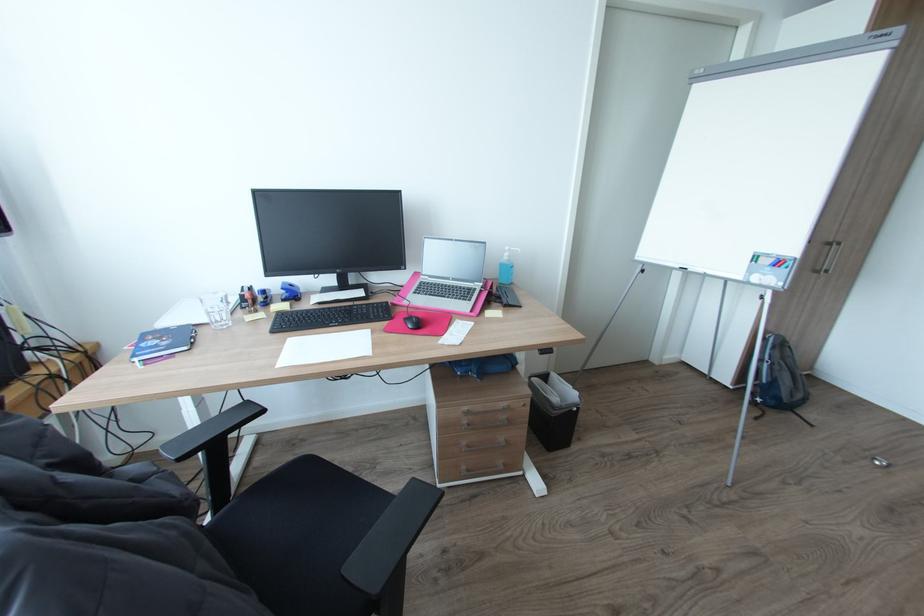
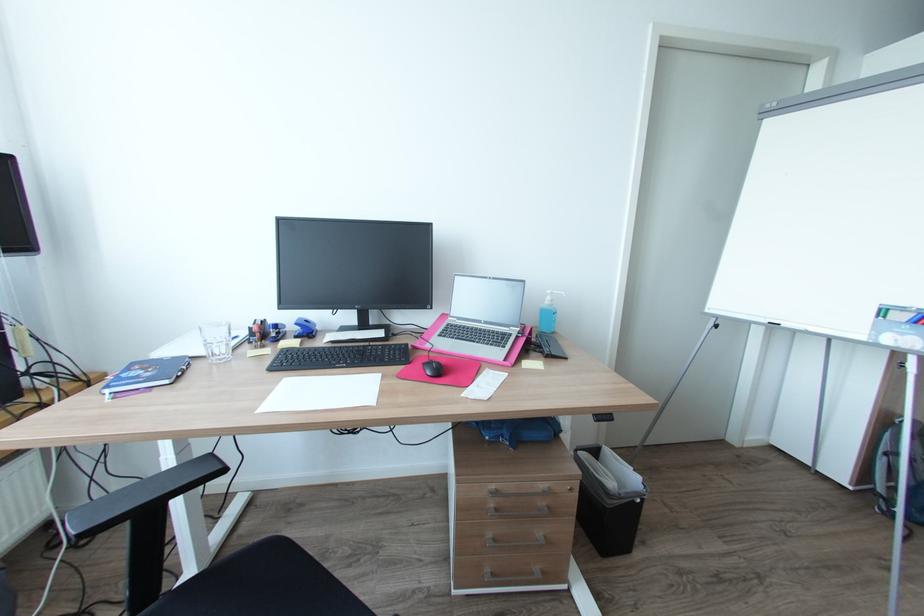
Question: I am providing you with two images of the same scene from different viewpoints. Please identify which objects are invisible in image2.

Choices:
 (A) glass drinking cup
 (B) chair sitting surface
 (C) black computer mouse
 (D) none of these

Answer: (D)